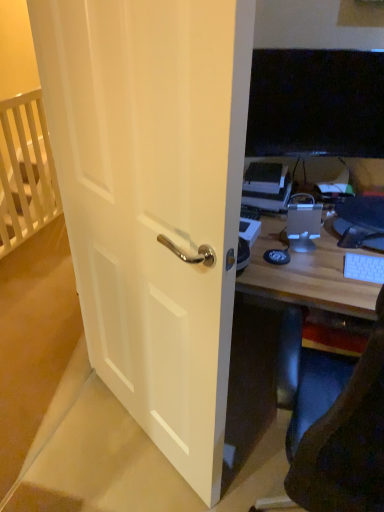
Where is `unoccupied area in front of black rubber mousepad at center`? This screenshot has height=512, width=384. unoccupied area in front of black rubber mousepad at center is located at coordinates (290, 281).